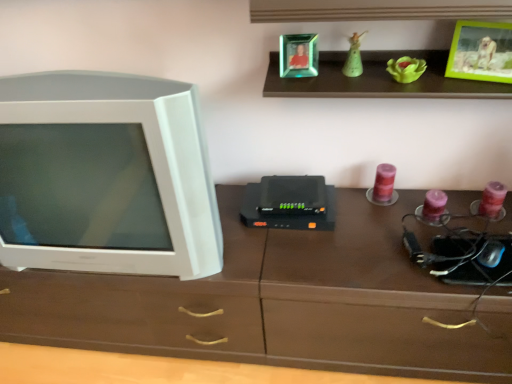
Question: Does purple wax candle at center-right touch green matte figurine at upper center?

Choices:
 (A) yes
 (B) no

Answer: (B)

Question: From a real-world perspective, is purple wax candle at center-right physically below green matte figurine at upper center?

Choices:
 (A) no
 (B) yes

Answer: (B)

Question: Does purple wax candle at center-right have a smaller size compared to green matte figurine at upper center?

Choices:
 (A) no
 (B) yes

Answer: (A)

Question: Does purple wax candle at center-right appear on the left side of green matte figurine at upper center?

Choices:
 (A) yes
 (B) no

Answer: (B)

Question: From a real-world perspective, is purple wax candle at center-right on top of green matte figurine at upper center?

Choices:
 (A) no
 (B) yes

Answer: (A)

Question: Considering the relative sizes of purple wax candle at center-right and green matte figurine at upper center in the image provided, is purple wax candle at center-right bigger than green matte figurine at upper center?

Choices:
 (A) no
 (B) yes

Answer: (B)

Question: From the image's perspective, does white plastic television at left appear lower than green plastic picture frame at upper right, which is the 1th picture frame in right-to-left order?

Choices:
 (A) yes
 (B) no

Answer: (A)

Question: Considering the relative positions of white plastic television at left and green plastic picture frame at upper right, which is the 1th picture frame in right-to-left order, in the image provided, is white plastic television at left in front of green plastic picture frame at upper right, which is the 1th picture frame in right-to-left order,?

Choices:
 (A) no
 (B) yes

Answer: (B)

Question: From the image's perspective, does white plastic television at left appear higher than green plastic picture frame at upper right, which is the 2th picture frame from left to right?

Choices:
 (A) yes
 (B) no

Answer: (B)

Question: Can you confirm if white plastic television at left is positioned to the left of green plastic picture frame at upper right, which is the 1th picture frame in right-to-left order?

Choices:
 (A) yes
 (B) no

Answer: (A)

Question: Does white plastic television at left touch green plastic picture frame at upper right, which is the 2th picture frame from left to right?

Choices:
 (A) no
 (B) yes

Answer: (A)

Question: Is white plastic television at left not inside green plastic picture frame at upper right, which is the 1th picture frame in right-to-left order?

Choices:
 (A) yes
 (B) no

Answer: (A)

Question: From a real-world perspective, is white plastic television at left located beneath green matte figurine at upper center?

Choices:
 (A) yes
 (B) no

Answer: (A)